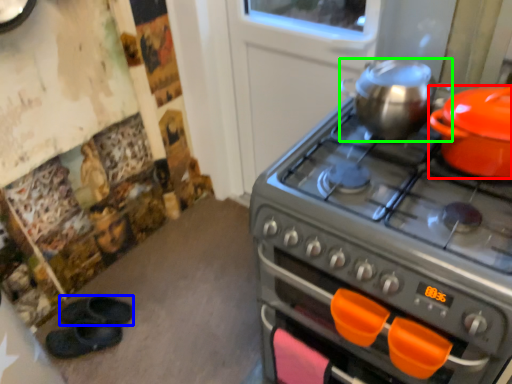
Question: Based on their relative distances, which object is nearer to kitchen appliance (highlighted by a red box)? Choose from footwear (highlighted by a blue box) and kitchen appliance (highlighted by a green box).

Choices:
 (A) footwear
 (B) kitchen appliance

Answer: (B)